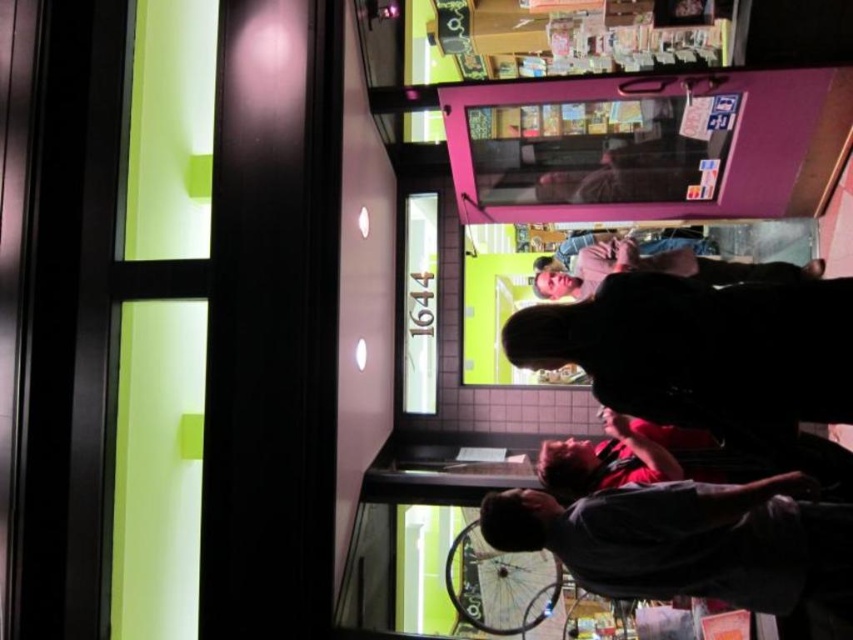
Which is behind, point (668, 310) or point (831, 506)?

Positioned behind is point (831, 506).

Is dark matte jacket at center positioned at the back of dark gray shirt at lower right?

No, dark matte jacket at center is in front of dark gray shirt at lower right.

Where is `dark matte jacket at center`? dark matte jacket at center is located at coordinates (701, 349).

Is dark matte jacket at center to the right of matte pink shirt at center from the viewer's perspective?

Incorrect, dark matte jacket at center is not on the right side of matte pink shirt at center.

Does dark matte jacket at center have a greater height compared to matte pink shirt at center?

Yes, dark matte jacket at center is taller than matte pink shirt at center.

I want to click on dark matte jacket at center, so click(x=701, y=349).

Which is above, dark gray shirt at lower right or matte pink shirt at center?

matte pink shirt at center

From the picture: Between dark gray shirt at lower right and matte pink shirt at center, which one has more height?

dark gray shirt at lower right

What do you see at coordinates (689, 540) in the screenshot? I see `dark gray shirt at lower right` at bounding box center [689, 540].

At what (x,y) coordinates should I click in order to perform the action: click on dark gray shirt at lower right. Please return your answer as a coordinate pair (x, y). The image size is (853, 640). Looking at the image, I should click on (689, 540).